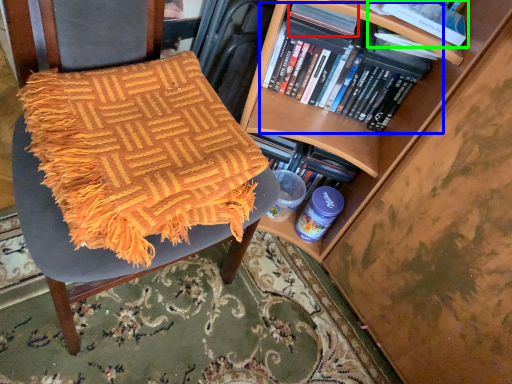
Question: Which object is the farthest from paperback book (highlighted by a red box)? Choose among these: book (highlighted by a blue box) or book (highlighted by a green box).

Choices:
 (A) book
 (B) book

Answer: (B)